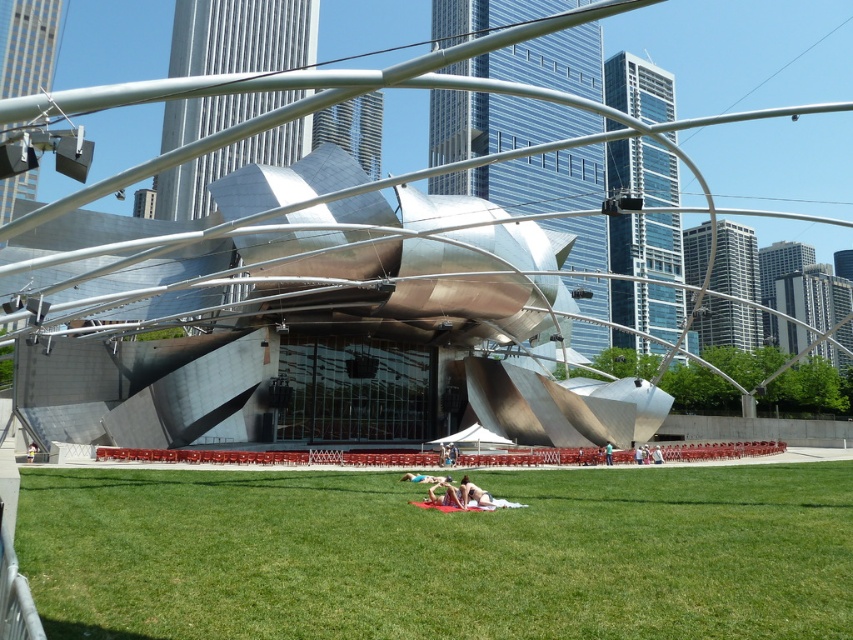
Question: Is green grass at lower center smaller than smooth skin person at center?

Choices:
 (A) no
 (B) yes

Answer: (A)

Question: Can you confirm if skinny jeans at center is smaller than smooth skin person at center?

Choices:
 (A) no
 (B) yes

Answer: (B)

Question: Considering the real-world distances, which object is farthest from the skinny jeans at center?

Choices:
 (A) green grass at lower center
 (B) smooth skin person at center

Answer: (A)

Question: Which is farther from the smooth skin person at center?

Choices:
 (A) skinny jeans at center
 (B) green grass at lower center

Answer: (B)

Question: Does skinny jeans at center have a smaller size compared to smooth skin person at center?

Choices:
 (A) yes
 (B) no

Answer: (A)

Question: Which is farther from the green grass at lower center?

Choices:
 (A) skinny jeans at center
 (B) smooth skin person at center

Answer: (B)